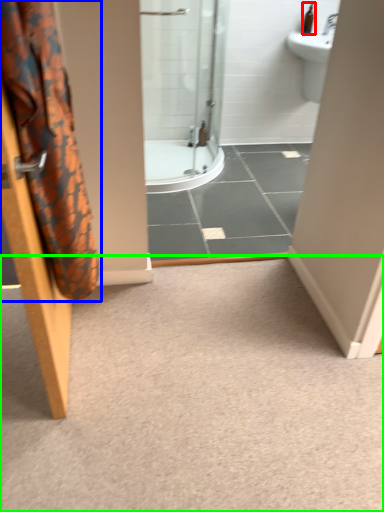
Question: Considering the real-world distances, which object is farthest from toiletry (highlighted by a red box)? shower curtain (highlighted by a blue box) or plain (highlighted by a green box)?

Choices:
 (A) shower curtain
 (B) plain

Answer: (A)